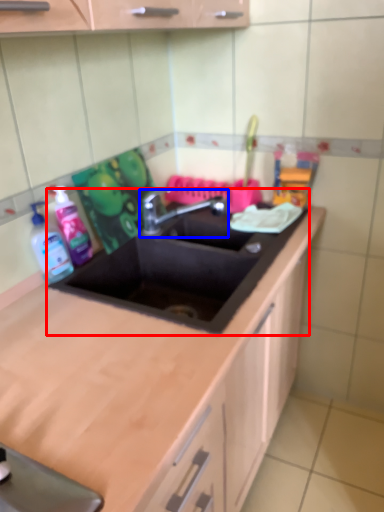
Question: Which point is closer to the camera, sink (highlighted by a red box) or tap (highlighted by a blue box)?

Choices:
 (A) sink
 (B) tap

Answer: (A)